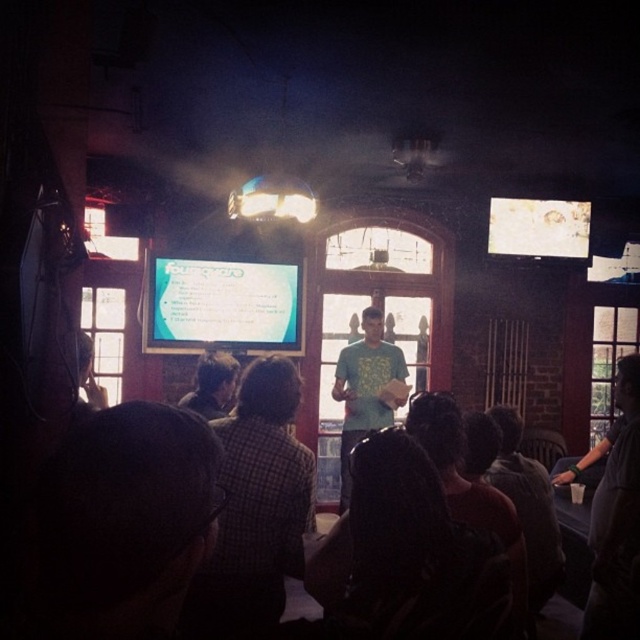
You are a photographer positioned at the camera. You want to capture a closeup shot of the checkered fabric shirt at lower left. Can you move closer to it without leaving the room? The room has a minimum distance requirement of 2 meters between participants.

The checkered fabric shirt at lower left is 2.30 meters from the camera. Since the minimum distance requirement is 2 meters, you can move closer by 0.30 meters to get the closeup shot without violating the requirement.